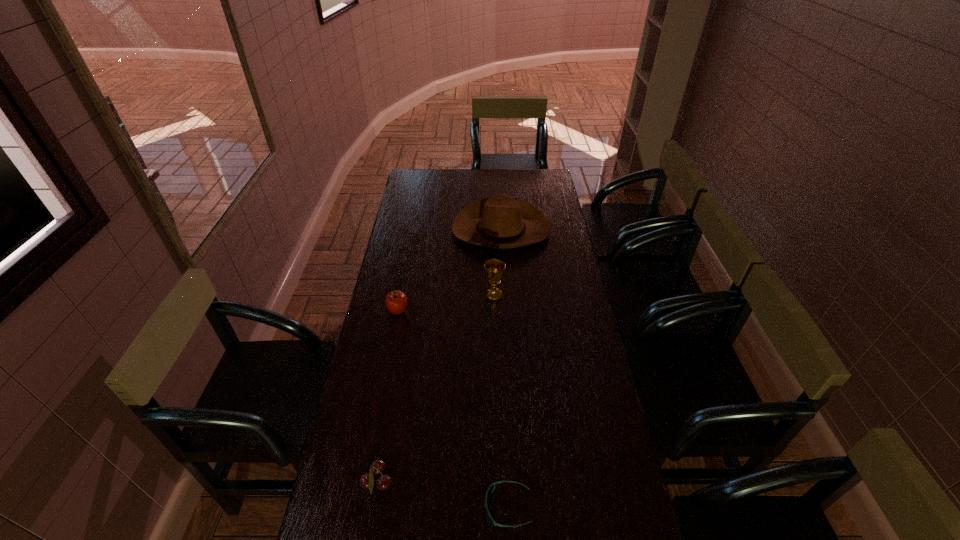
In order to click on free space that satisfies the following two spatial constraints: 1. on the front side of the chalice; 2. on the leaves of the cherry in this screenshot , I will do `click(500, 483)`.

Identify the location of vacant point that satisfies the following two spatial constraints: 1. on the back side of the second farthest object; 2. on the left side of the third nearest object. The height and width of the screenshot is (540, 960). (400, 296).

Find the location of a particular element. The height and width of the screenshot is (540, 960). blank space that satisfies the following two spatial constraints: 1. on the front side of the fourth nearest object; 2. on the leaves of the second shortest object is located at coordinates (500, 483).

At what (x,y) coordinates should I click in order to perform the action: click on vacant area in the image that satisfies the following two spatial constraints: 1. on the front-facing side of the cowboy hat; 2. on the leaves of the fourth tallest object. Please return your answer as a coordinate pair (x, y). The height and width of the screenshot is (540, 960). Looking at the image, I should click on (516, 483).

This screenshot has width=960, height=540. Identify the location of vacant space that satisfies the following two spatial constraints: 1. on the back side of the apple; 2. on the right side of the chalice. (400, 296).